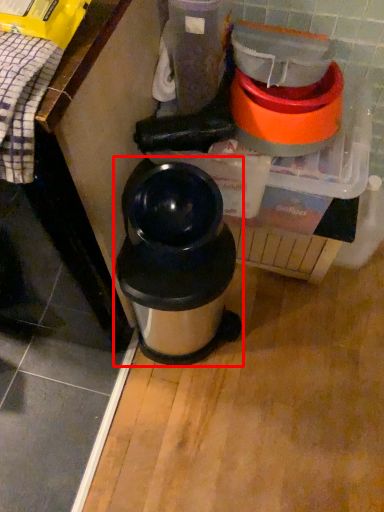
Question: From the image's perspective, where is waste container (annotated by the red box) located in relation to blender in the image?

Choices:
 (A) above
 (B) below

Answer: (B)